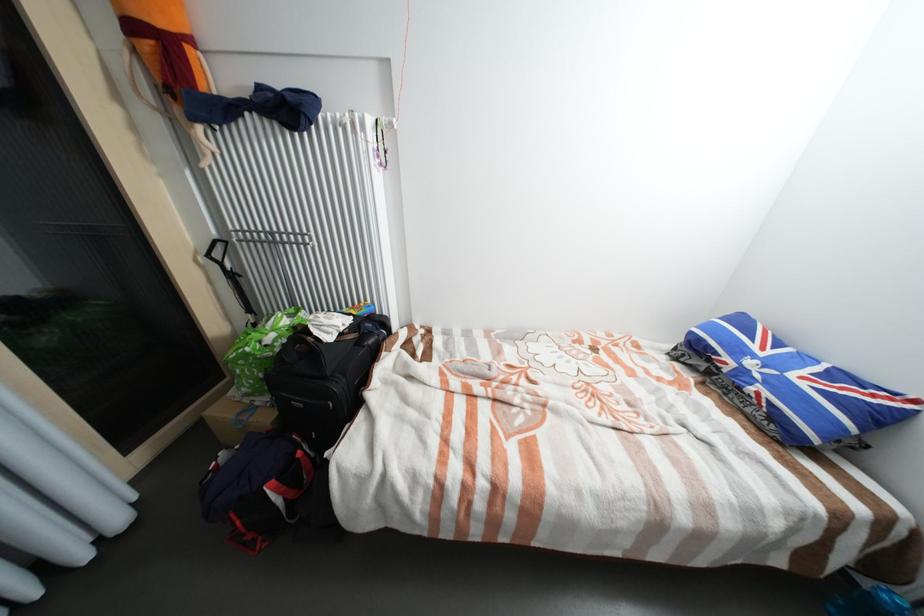
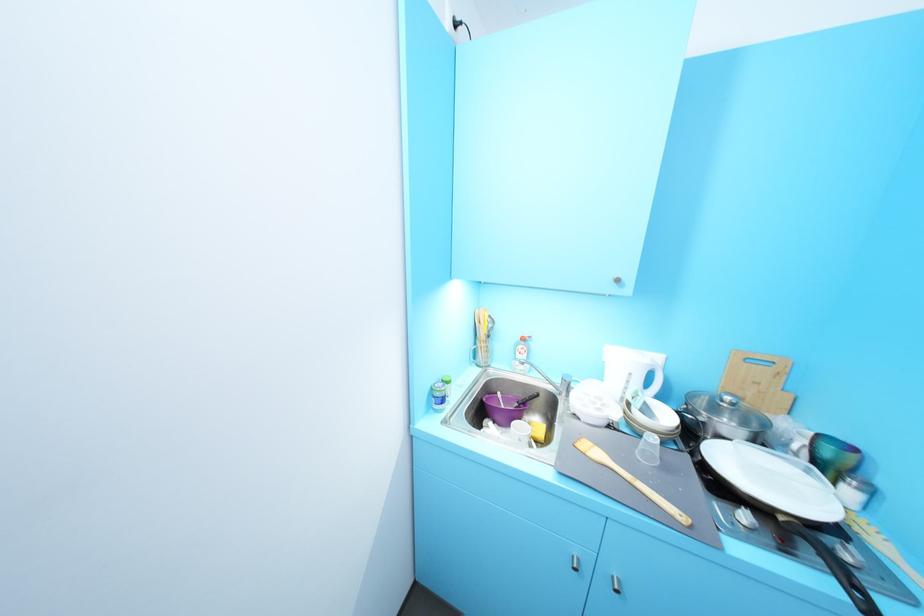
Question: I am providing you with two images of the same scene from different viewpoints. Please identify which objects are invisible in image2.

Choices:
 (A) black luggage bag
 (B) kettle handle
 (C) white striped vase
 (D) plastic cup

Answer: (A)